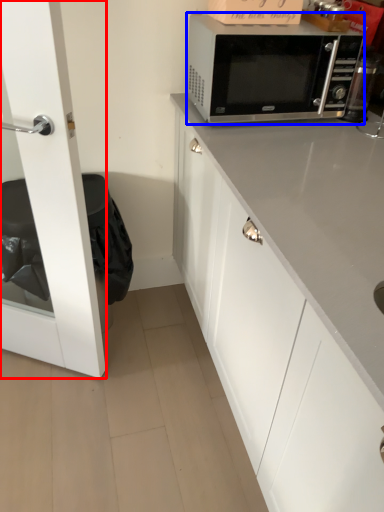
Question: Among these objects, which one is nearest to the camera, glass door (highlighted by a red box) or microwave oven (highlighted by a blue box)?

Choices:
 (A) glass door
 (B) microwave oven

Answer: (A)